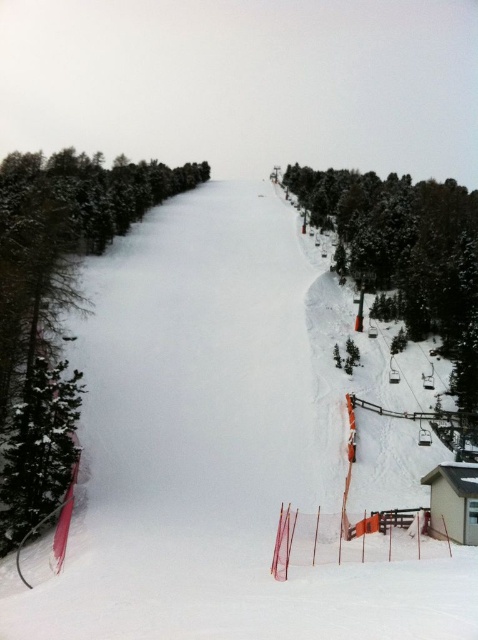
You are a skier planning to ski down the slope. You notice the white snow ski slope at center and the green matte tree at left. How far apart are these two landmarks?

The white snow ski slope at center is 32.16 meters from the green matte tree at left.